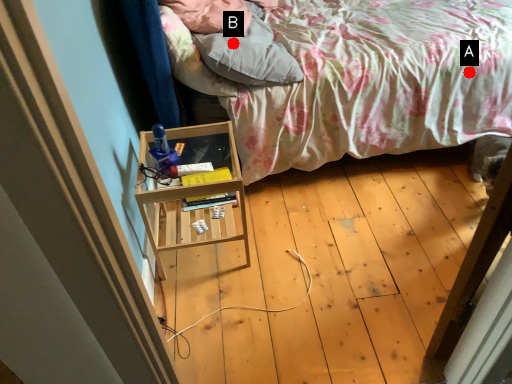
Question: Two points are circled on the image, labeled by A and B beside each circle. Which point is closer to the camera?

Choices:
 (A) A is closer
 (B) B is closer

Answer: (B)